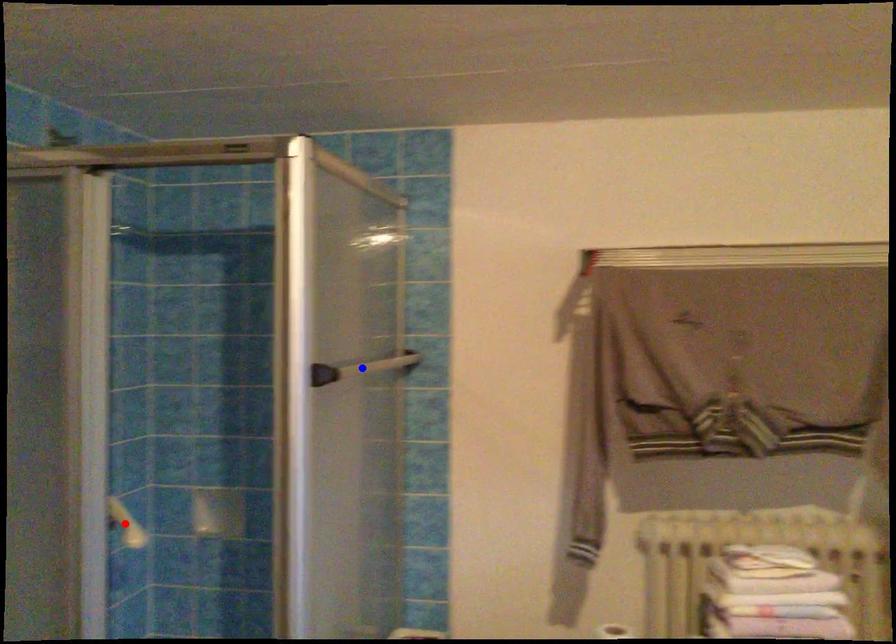
Question: In the image, two points are highlighted. Which point is nearer to the camera? Reply with the corresponding letter.

Choices:
 (A) blue point
 (B) red point

Answer: (A)